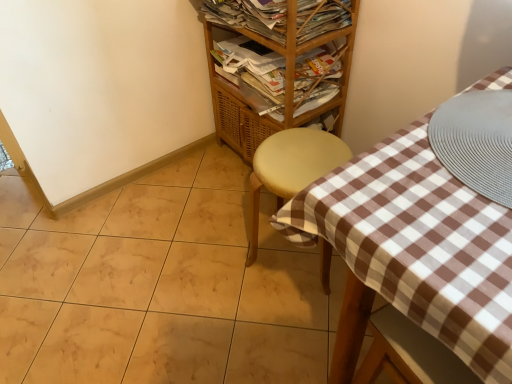
This screenshot has width=512, height=384. In order to click on free space above matte yellow stool at center (from a real-world perspective) in this screenshot , I will do `click(287, 153)`.